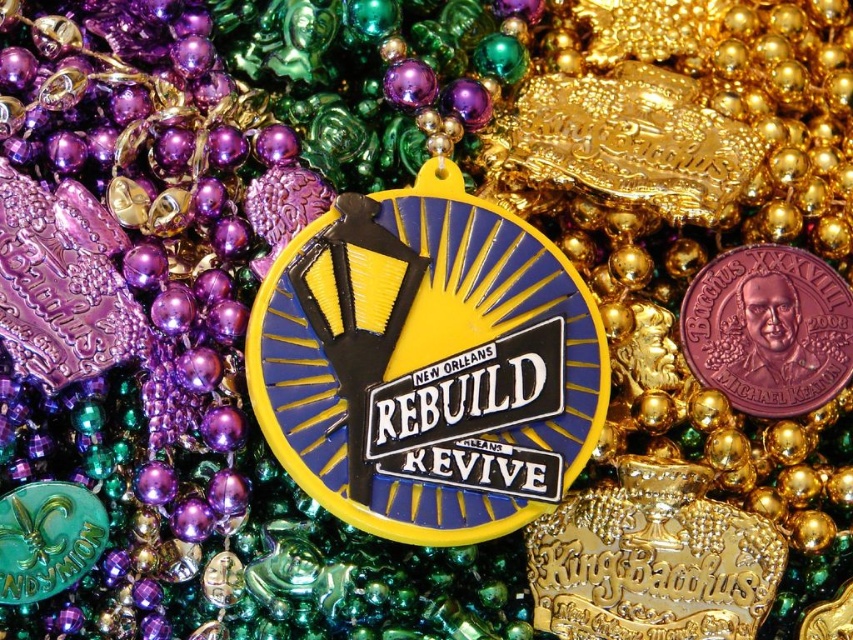
Does yellow plastic badge at center have a lesser width compared to pink clay coin at center?

Incorrect, yellow plastic badge at center's width is not less than pink clay coin at center's.

Between yellow plastic badge at center and pink clay coin at center, which one is positioned higher?

pink clay coin at center

The height and width of the screenshot is (640, 853). What are the coordinates of `yellow plastic badge at center` in the screenshot? It's located at (427, 364).

Find the location of a particular element. The image size is (853, 640). yellow plastic badge at center is located at coordinates (427, 364).